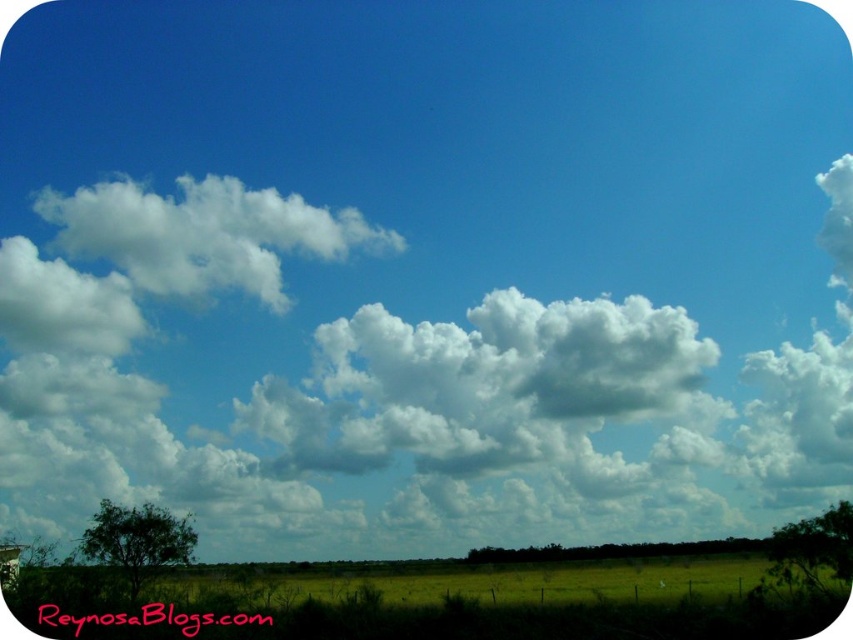
Between point (112, 180) and point (146, 600), which one is positioned behind?

The point (112, 180) is more distant.

Does point (210, 280) come in front of point (431, 570)?

No, it is behind (431, 570).

Does point (111, 260) come closer to viewer compared to point (756, 572)?

No, (111, 260) is further to viewer.

You are a GUI agent. You are given a task and a screenshot of the screen. Output one action in this format:
    pyautogui.click(x=<x>, y=<y>)
    Task: Click on the white fluffy cloud at upper left
    The height and width of the screenshot is (640, 853).
    Given the screenshot: What is the action you would take?
    pyautogui.click(x=202, y=234)